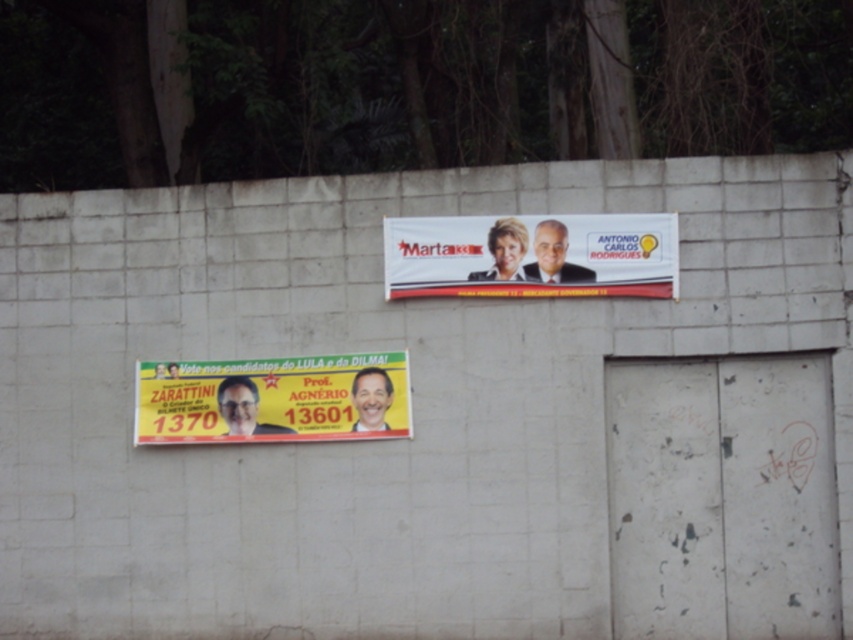
You are a painter who needs to hang a new poster between the matte plastic banner at upper center and the smooth yellow face at center on the weathered concrete wall. The new poster is 12 inches wide. Can you fit it between them without overlapping either?

The distance between the matte plastic banner at upper center and the smooth yellow face at center is 22.52 inches. Since the new poster is only 12 inches wide, there is enough space to fit it between them without overlapping either object.

You are a painter who needs to know the relative sizes of the objects to plan your work. Which object is taller between the matte plastic banner at upper center and the smooth yellow face at center?

The matte plastic banner at upper center is taller than the smooth yellow face at center according to the description.